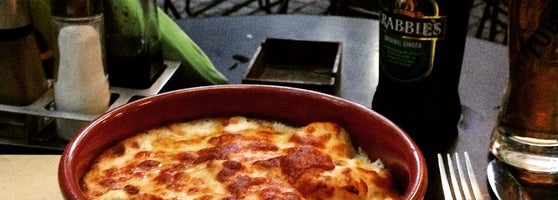
You are a GUI agent. You are given a task and a screenshot of the screen. Output one action in this format:
    pyautogui.click(x=<x>, y=<y>)
    Task: Click on the red pan
    
    Given the screenshot: What is the action you would take?
    pyautogui.click(x=399, y=136)